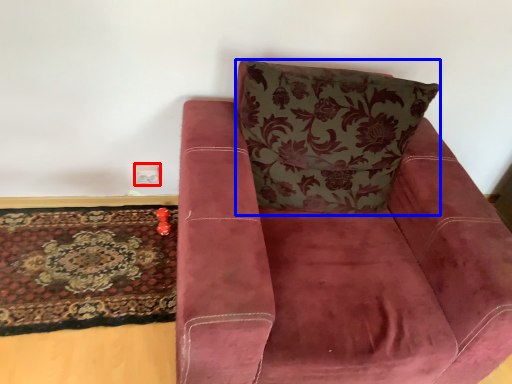
Question: Which of the following is the farthest to the observer, electric outlet (highlighted by a red box) or throw pillow (highlighted by a blue box)?

Choices:
 (A) electric outlet
 (B) throw pillow

Answer: (A)